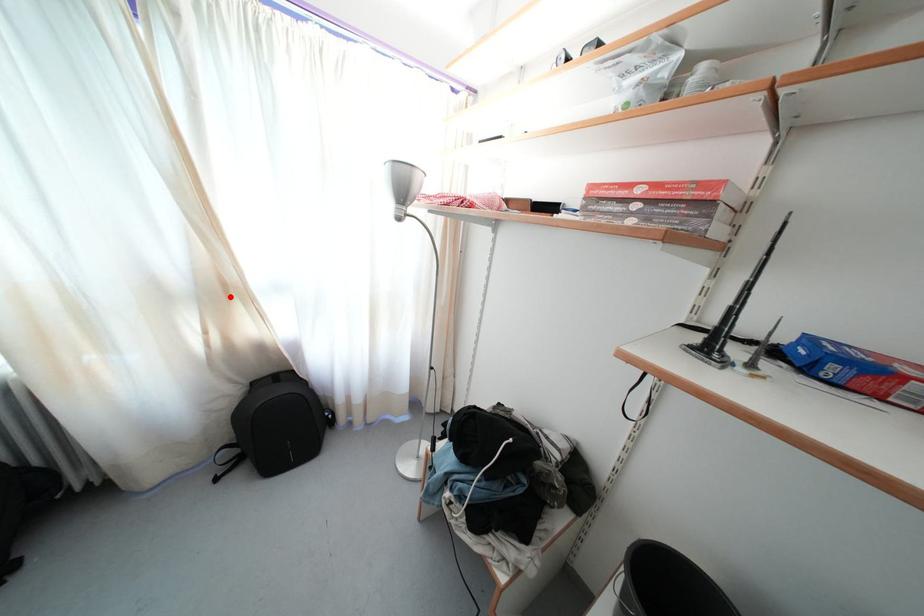
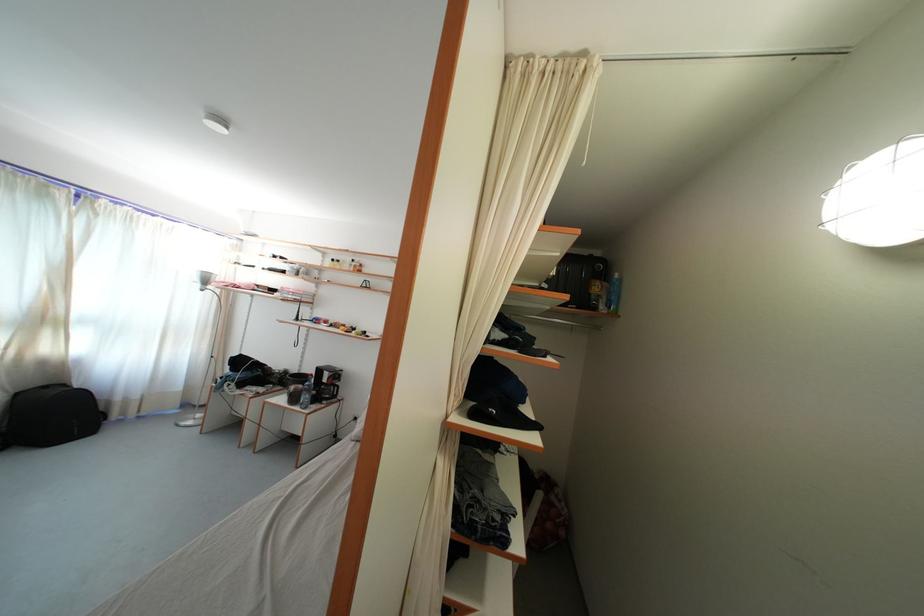
In the second image, find the point that corresponds to the highlighted location in the first image.

(52, 326)